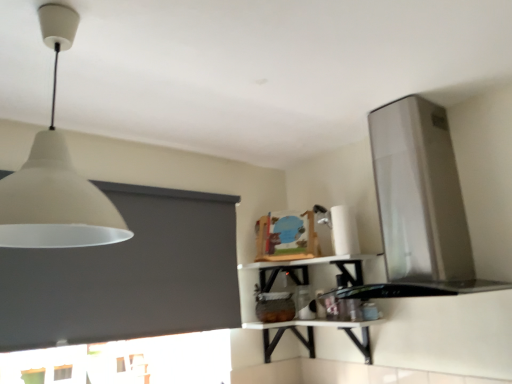
Question: Considering the relative positions of white glossy counter top at lower center and satin silver vent at upper right in the image provided, is white glossy counter top at lower center to the left or to the right of satin silver vent at upper right?

Choices:
 (A) left
 (B) right

Answer: (A)

Question: Is white glossy counter top at lower center bigger or smaller than satin silver vent at upper right?

Choices:
 (A) small
 (B) big

Answer: (A)

Question: Estimate the real-world distances between objects in this image. Which object is farther from the white glossy shelf at upper center?

Choices:
 (A) white glossy counter top at lower center
 (B) dark gray matte window screen at upper left
 (C) white glossy table at center
 (D) white matte lampshade at upper left
 (E) satin silver vent at upper right

Answer: (D)

Question: Which is nearer to the white glossy shelf at upper center?

Choices:
 (A) white glossy table at center
 (B) dark gray matte window screen at upper left
 (C) satin silver vent at upper right
 (D) white glossy counter top at lower center
 (E) white matte lampshade at upper left

Answer: (A)